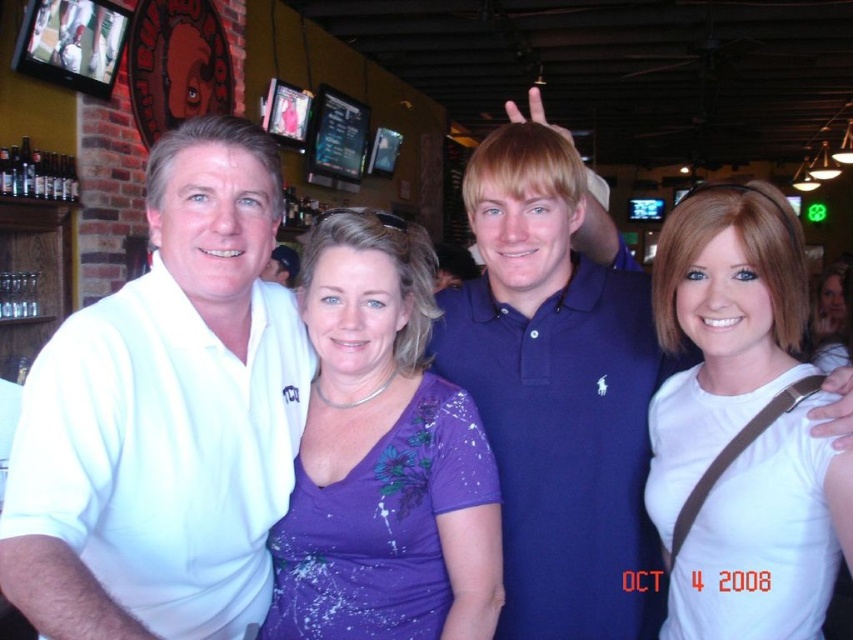
Question: Which object is farther from the camera taking this photo?

Choices:
 (A) white matte shirt at center
 (B) purple fabric dress at center
 (C) white matte polo shirt at left
 (D) purple matte shirt at center

Answer: (B)

Question: Is purple matte shirt at center wider than purple fabric dress at center?

Choices:
 (A) no
 (B) yes

Answer: (A)

Question: Which point is farther from the camera taking this photo?

Choices:
 (A) (729, 554)
 (B) (326, 541)
 (C) (500, 627)

Answer: (C)

Question: Does white matte polo shirt at left appear under purple matte shirt at center?

Choices:
 (A) yes
 (B) no

Answer: (B)

Question: Does purple matte shirt at center have a lesser width compared to white matte shirt at center?

Choices:
 (A) no
 (B) yes

Answer: (A)

Question: Which object is positioned farthest from the purple fabric dress at center?

Choices:
 (A) blue cotton polo shirt at center
 (B) white matte shirt at center
 (C) white matte polo shirt at left
 (D) purple matte shirt at center

Answer: (C)